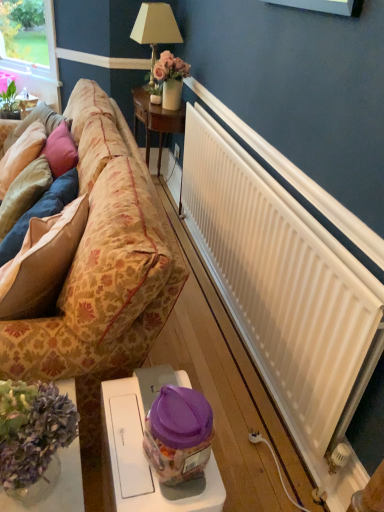
In order to face woodenmaterial/texturetable at upper center, the 3th table in the bottom-to-top sequence, should I rotate leftwards or rightwards?

Rotate your view left by about 5.004°.

This screenshot has width=384, height=512. What do you see at coordinates (104, 261) in the screenshot? I see `floral-patterned fabric couch at left` at bounding box center [104, 261].

In order to face white plastic table at lower center, marked as the first table in a front-to-back arrangement, should I rotate leftwards or rightwards?

It's best to rotate left around 5.912 degrees.

This screenshot has width=384, height=512. Describe the element at coordinates (42, 263) in the screenshot. I see `suede-like beige pillow at left, the 3th pillow positioned from the left` at that location.

The image size is (384, 512). Describe the element at coordinates (41, 212) in the screenshot. I see `velvet floral pillow at left, positioned as the 2th pillow in left-to-right order` at that location.

You are a GUI agent. You are given a task and a screenshot of the screen. Output one action in this format:
    pyautogui.click(x=<x>, y=<y>)
    Task: Click on the translucent plastic jar at lower center
    The height and width of the screenshot is (512, 384).
    Given the screenshot: What is the action you would take?
    (x=178, y=434)

In the image, is woodenmaterial/texturetable at upper center, acting as the 3th table starting from the front, positioned in front of or behind velvet floral pillow at left, the 2th pillow from the right?

In the image, woodenmaterial/texturetable at upper center, acting as the 3th table starting from the front, appears behind velvet floral pillow at left, the 2th pillow from the right.

From a real-world perspective, relative to velvet floral pillow at left, positioned as the 2th pillow in left-to-right order, is woodenmaterial/texturetable at upper center, which appears as the first table when viewed from the top, vertically above or below?

Clearly, from a real-world perspective, woodenmaterial/texturetable at upper center, which appears as the first table when viewed from the top, is below velvet floral pillow at left, positioned as the 2th pillow in left-to-right order.

Does point (136, 136) come closer to viewer compared to point (65, 181)?

No, it is behind (65, 181).

How much distance is there between woodenmaterial/texturetable at upper center, which is counted as the 1th table, starting from the back, and velvet floral pillow at left, the 2th pillow from the right?

The distance of woodenmaterial/texturetable at upper center, which is counted as the 1th table, starting from the back, from velvet floral pillow at left, the 2th pillow from the right, is 1.34 meters.

How many degrees apart are the facing directions of white plastic table at lower center, arranged as the third table when viewed from the back, and translucent plastic jar at lower center?

Result: There is a 0.329-degree angle between the facing directions of white plastic table at lower center, arranged as the third table when viewed from the back, and translucent plastic jar at lower center.

Is white plastic table at lower center, the 2th table ordered from the bottom, beside translucent plastic jar at lower center?

Yes, white plastic table at lower center, the 2th table ordered from the bottom, is in contact with translucent plastic jar at lower center.

Considering the sizes of objects white plastic table at lower center, marked as the first table in a front-to-back arrangement, and translucent plastic jar at lower center in the image provided, who is bigger, white plastic table at lower center, marked as the first table in a front-to-back arrangement, or translucent plastic jar at lower center?

Bigger between the two is white plastic table at lower center, marked as the first table in a front-to-back arrangement.

Is point (181, 484) positioned before point (160, 394)?

No, (181, 484) is further to viewer.

Considering the sizes of white plastic table at lower center, acting as the second table starting from the top, and beige fabric lampshade at upper center in the image, is white plastic table at lower center, acting as the second table starting from the top, taller or shorter than beige fabric lampshade at upper center?

white plastic table at lower center, acting as the second table starting from the top, is taller than beige fabric lampshade at upper center.

Who is bigger, white plastic table at lower center, acting as the second table starting from the top, or beige fabric lampshade at upper center?

beige fabric lampshade at upper center.

Is white plastic table at lower center, acting as the second table starting from the top, not inside beige fabric lampshade at upper center?

Yes.

This screenshot has height=512, width=384. There is a velvet floral pillow at left, positioned as the 2th pillow in left-to-right order. Identify the location of the 1st pillow above it (from a real-world perspective). (21, 155).

In the scene shown: Would you consider velvet floral pillow at left, the 2th pillow from the right, to be distant from velvet beige pillow at left, placed as the 1th pillow when sorted from left to right?

That's not correct — velvet floral pillow at left, the 2th pillow from the right, is a little close to velvet beige pillow at left, placed as the 1th pillow when sorted from left to right.

From a real-world perspective, is velvet floral pillow at left, positioned as the 2th pillow in left-to-right order, positioned under velvet beige pillow at left, which appears as the 3th pillow when viewed from the right, based on gravity?

Yes, from a real-world perspective, velvet floral pillow at left, positioned as the 2th pillow in left-to-right order, is below velvet beige pillow at left, which appears as the 3th pillow when viewed from the right.

Is velvet floral pillow at left, positioned as the 2th pillow in left-to-right order, bigger than velvet beige pillow at left, which appears as the 3th pillow when viewed from the right?

Correct, velvet floral pillow at left, positioned as the 2th pillow in left-to-right order, is larger in size than velvet beige pillow at left, which appears as the 3th pillow when viewed from the right.

Who is bigger, velvet floral pillow at left, positioned as the 2th pillow in left-to-right order, or suede-like beige pillow at left, the 3th pillow positioned from the left?

velvet floral pillow at left, positioned as the 2th pillow in left-to-right order.

Find the location of a particular element. The height and width of the screenshot is (512, 384). pillow on the right of velvet floral pillow at left, the 2th pillow from the right is located at coordinates (42, 263).

Is velvet floral pillow at left, the 2th pillow from the right, facing away from suede-like beige pillow at left, placed as the 1th pillow when sorted from right to left?

Yes, velvet floral pillow at left, the 2th pillow from the right, is facing away from suede-like beige pillow at left, placed as the 1th pillow when sorted from right to left.

In terms of width, does white matte radiator at right look wider or thinner when compared to clear glass vase at lower left, acting as the third table starting from the top?

Clearly, white matte radiator at right has less width compared to clear glass vase at lower left, acting as the third table starting from the top.

Could clear glass vase at lower left, arranged as the 1th table when ordered from the bottom, be considered to be inside white matte radiator at right?

Actually, clear glass vase at lower left, arranged as the 1th table when ordered from the bottom, is outside white matte radiator at right.

From a real-world perspective, which object rests below the other?

In real-world perspective, clear glass vase at lower left, arranged as the 1th table when ordered from the bottom, is lower.

How many degrees apart are the facing directions of white matte radiator at right and clear glass vase at lower left, placed as the second table when sorted from front to back?

white matte radiator at right and clear glass vase at lower left, placed as the second table when sorted from front to back, are facing 0.483 degrees away from each other.

From the image's perspective, is translucent plastic jar at lower center over suede-like beige pillow at left, the 3th pillow positioned from the left?

No.

Is translucent plastic jar at lower center smaller than suede-like beige pillow at left, placed as the 1th pillow when sorted from right to left?

Yes, translucent plastic jar at lower center is smaller than suede-like beige pillow at left, placed as the 1th pillow when sorted from right to left.

Looking at this image, considering the sizes of objects translucent plastic jar at lower center and suede-like beige pillow at left, placed as the 1th pillow when sorted from right to left, in the image provided, who is taller, translucent plastic jar at lower center or suede-like beige pillow at left, placed as the 1th pillow when sorted from right to left,?

Standing taller between the two is suede-like beige pillow at left, placed as the 1th pillow when sorted from right to left.

What's the angular difference between translucent plastic jar at lower center and suede-like beige pillow at left, placed as the 1th pillow when sorted from right to left,'s facing directions?

There is a 18.8-degree angle between the facing directions of translucent plastic jar at lower center and suede-like beige pillow at left, placed as the 1th pillow when sorted from right to left.

I want to click on the 2nd pillow counting from the left of the woodenmaterial/texturetable at upper center, which appears as the first table when viewed from the top, so click(41, 212).

Find the location of a particular element. food on the right side of white plastic table at lower center, arranged as the third table when viewed from the back is located at coordinates (178, 434).

Considering their positions, is clear glass vase at lower left, acting as the third table starting from the top, positioned closer to white plastic table at lower center, the 2th table ordered from the bottom, than translucent plastic jar at lower center?

translucent plastic jar at lower center lies closer to white plastic table at lower center, the 2th table ordered from the bottom, than the other object.

Looking at the image, which one is located closer to beige fabric lampshade at upper center, velvet beige pillow at left, placed as the 1th pillow when sorted from left to right, or white plastic table at lower center, marked as the first table in a front-to-back arrangement?

Among the two, velvet beige pillow at left, placed as the 1th pillow when sorted from left to right, is located nearer to beige fabric lampshade at upper center.

From the picture: From the image, which object appears to be farther from velvet floral pillow at left, the 2th pillow from the right, suede-like beige pillow at left, placed as the 1th pillow when sorted from right to left, or translucent plastic jar at lower center?

translucent plastic jar at lower center is positioned further to the anchor velvet floral pillow at left, the 2th pillow from the right.

When comparing their distances from woodenmaterial/texturetable at upper center, which appears as the first table when viewed from the top, does floral-patterned fabric couch at left or translucent plastic jar at lower center seem closer?

Among the two, floral-patterned fabric couch at left is located nearer to woodenmaterial/texturetable at upper center, which appears as the first table when viewed from the top.

Looking at the image, which one is located closer to beige fabric lampshade at upper center, suede-like beige pillow at left, the 3th pillow positioned from the left, or translucent plastic jar at lower center?

suede-like beige pillow at left, the 3th pillow positioned from the left, lies closer to beige fabric lampshade at upper center than the other object.

When comparing their distances from beige fabric lampshade at upper center, does velvet beige pillow at left, which appears as the 3th pillow when viewed from the right, or velvet floral pillow at left, the 2th pillow from the right, seem further?

velvet floral pillow at left, the 2th pillow from the right, lies further to beige fabric lampshade at upper center than the other object.

Based on their spatial positions, is translucent plastic jar at lower center or velvet beige pillow at left, placed as the 1th pillow when sorted from left to right, closer to suede-like beige pillow at left, the 3th pillow positioned from the left?

translucent plastic jar at lower center is positioned closer to the anchor suede-like beige pillow at left, the 3th pillow positioned from the left.

Looking at the image, which one is located closer to velvet beige pillow at left, placed as the 1th pillow when sorted from left to right, suede-like beige pillow at left, placed as the 1th pillow when sorted from right to left, or white matte radiator at right?

suede-like beige pillow at left, placed as the 1th pillow when sorted from right to left, is closer to velvet beige pillow at left, placed as the 1th pillow when sorted from left to right.

Locate an element on the screen. The image size is (384, 512). studio couch that lies between velvet floral pillow at left, the 2th pillow from the right, and clear glass vase at lower left, placed as the second table when sorted from front to back, from top to bottom is located at coordinates pyautogui.click(x=104, y=261).

The height and width of the screenshot is (512, 384). Identify the location of radiator that lies between beige fabric lampshade at upper center and clear glass vase at lower left, acting as the third table starting from the top, from top to bottom. (279, 281).

At what (x,y) coordinates should I click in order to perform the action: click on radiator located between translucent plastic jar at lower center and beige fabric lampshade at upper center in the depth direction. Please return your answer as a coordinate pair (x, y). This screenshot has height=512, width=384. Looking at the image, I should click on (279, 281).

At what (x,y) coordinates should I click in order to perform the action: click on food between floral-patterned fabric couch at left and white matte radiator at right from left to right. Please return your answer as a coordinate pair (x, y). This screenshot has width=384, height=512. Looking at the image, I should click on (178, 434).